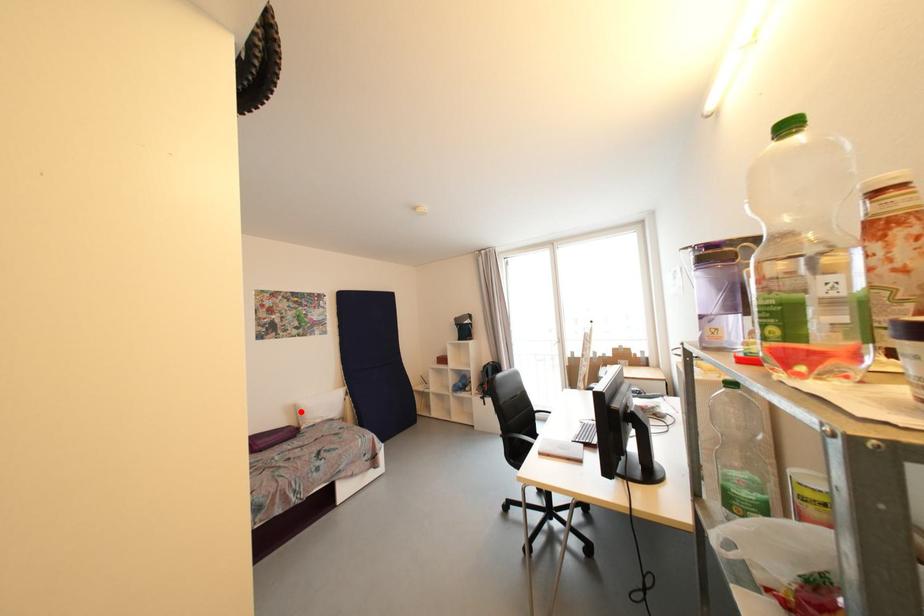
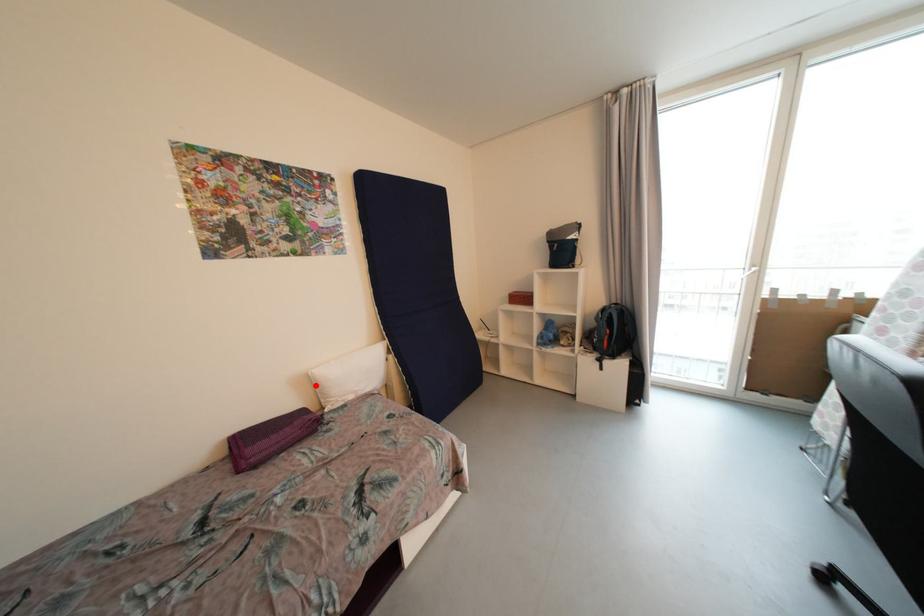
I am providing you with two images of the same scene from different viewpoints. A red point is marked on the first image and another point is marked on the second image. Do the highlighted points in image1 and image2 indicate the same real-world spot?

Yes